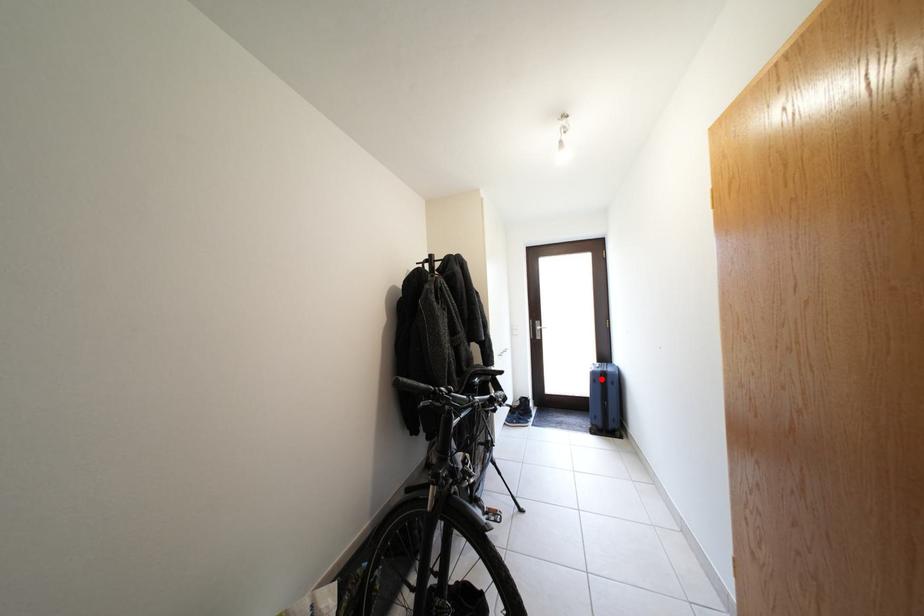
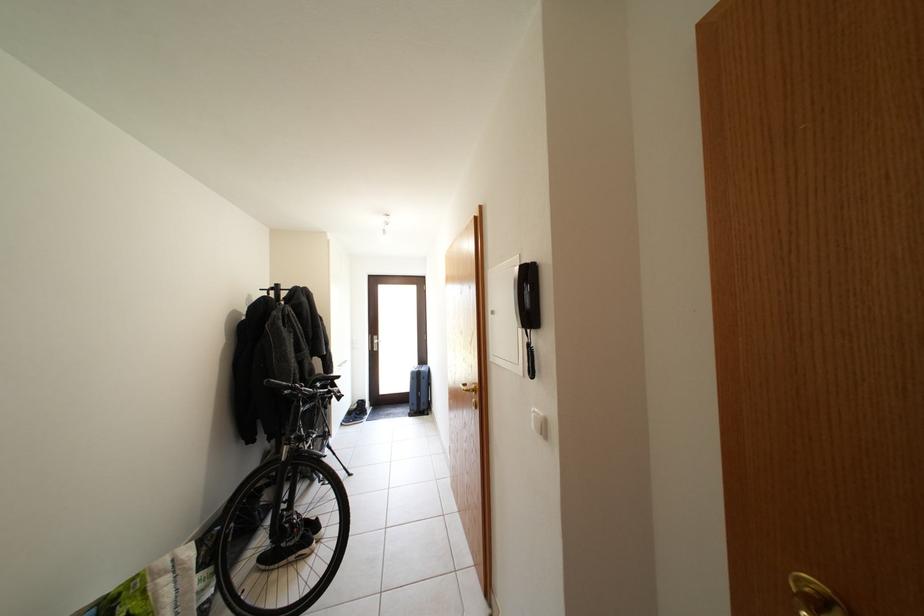
The point at the highlighted location is marked in the first image. Where is the corresponding point in the second image?

(420, 379)